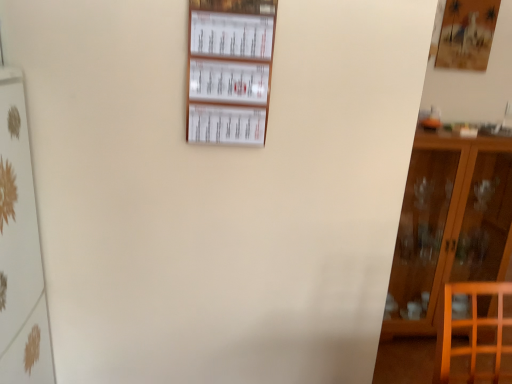
Question: Is there a large distance between white paperboard at upper center, positioned as the 2th shelf in bottom-to-top order, and white glossy shelf at left, which is counted as the first shelf, starting from the left?

Choices:
 (A) yes
 (B) no

Answer: (B)

Question: Is white paperboard at upper center, positioned as the 1th shelf in right-to-left order, oriented away from white glossy shelf at left, placed as the 2th shelf when sorted from right to left?

Choices:
 (A) no
 (B) yes

Answer: (A)

Question: Is the depth of white paperboard at upper center, positioned as the 1th shelf in right-to-left order, greater than that of white glossy shelf at left, which is counted as the first shelf, starting from the left?

Choices:
 (A) no
 (B) yes

Answer: (B)

Question: Is white paperboard at upper center, positioned as the 1th shelf in right-to-left order, outside of white glossy shelf at left, which is the first shelf from bottom to top?

Choices:
 (A) no
 (B) yes

Answer: (B)

Question: Is white paperboard at upper center, which is the 1th shelf from top to bottom, shorter than white glossy shelf at left, placed as the 2th shelf when sorted from right to left?

Choices:
 (A) yes
 (B) no

Answer: (A)

Question: From a real-world perspective, is white glossy shelf at left, placed as the 2th shelf when sorted from right to left, positioned above or below brown wooden cabinet at right?

Choices:
 (A) above
 (B) below

Answer: (A)

Question: Is white glossy shelf at left, which is the second shelf in top-to-bottom order, to the left or to the right of brown wooden cabinet at right in the image?

Choices:
 (A) left
 (B) right

Answer: (A)

Question: From the image's perspective, is white glossy shelf at left, which is counted as the first shelf, starting from the left, located above or below brown wooden cabinet at right?

Choices:
 (A) below
 (B) above

Answer: (A)

Question: Looking at the image, does white glossy shelf at left, placed as the 2th shelf when sorted from right to left, seem bigger or smaller compared to brown wooden cabinet at right?

Choices:
 (A) small
 (B) big

Answer: (A)

Question: In terms of width, does brown wooden cabinet at right look wider or thinner when compared to white glossy shelf at left, which is the second shelf in top-to-bottom order?

Choices:
 (A) thin
 (B) wide

Answer: (B)

Question: Considering their positions, is brown wooden cabinet at right located in front of or behind white glossy shelf at left, which is the second shelf in top-to-bottom order?

Choices:
 (A) behind
 (B) front

Answer: (A)

Question: From the image's perspective, is brown wooden cabinet at right positioned above or below white glossy shelf at left, placed as the 2th shelf when sorted from right to left?

Choices:
 (A) below
 (B) above

Answer: (B)

Question: Is brown wooden cabinet at right taller or shorter than white glossy shelf at left, placed as the 2th shelf when sorted from right to left?

Choices:
 (A) short
 (B) tall

Answer: (A)

Question: Is white paperboard at upper center, positioned as the 2th shelf in bottom-to-top order, in front of or behind brown wooden cabinet at right in the image?

Choices:
 (A) behind
 (B) front

Answer: (B)

Question: From their relative heights in the image, would you say white paperboard at upper center, the 2th shelf from the left, is taller or shorter than brown wooden cabinet at right?

Choices:
 (A) tall
 (B) short

Answer: (B)